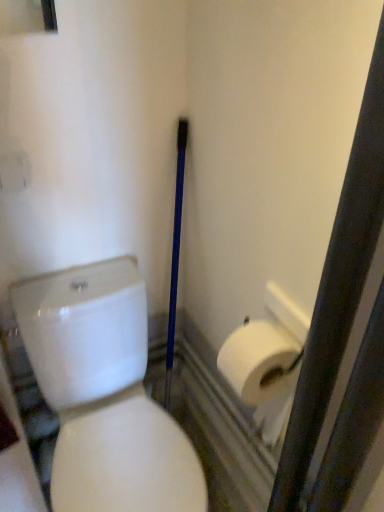
Question: Considering the relative sizes of white matte toilet paper at right and white glossy toilet at center in the image provided, is white matte toilet paper at right taller than white glossy toilet at center?

Choices:
 (A) yes
 (B) no

Answer: (B)

Question: Considering the relative sizes of white matte toilet paper at right and white glossy toilet at center in the image provided, is white matte toilet paper at right bigger than white glossy toilet at center?

Choices:
 (A) no
 (B) yes

Answer: (A)

Question: Is white matte toilet paper at right smaller than white glossy toilet at center?

Choices:
 (A) no
 (B) yes

Answer: (B)

Question: Does white matte toilet paper at right have a lesser height compared to white glossy toilet at center?

Choices:
 (A) yes
 (B) no

Answer: (A)

Question: Are white matte toilet paper at right and white glossy toilet at center making contact?

Choices:
 (A) no
 (B) yes

Answer: (A)

Question: Could you tell me if white matte toilet paper at right is turned towards white glossy toilet at center?

Choices:
 (A) no
 (B) yes

Answer: (B)

Question: From a real-world perspective, is white glossy toilet at center under white matte toilet paper at right?

Choices:
 (A) yes
 (B) no

Answer: (A)

Question: Considering the relative positions of white glossy toilet at center and white matte toilet paper at right in the image provided, is white glossy toilet at center to the right of white matte toilet paper at right from the viewer's perspective?

Choices:
 (A) yes
 (B) no

Answer: (B)

Question: Does white glossy toilet at center have a smaller size compared to white matte toilet paper at right?

Choices:
 (A) yes
 (B) no

Answer: (B)

Question: Does white glossy toilet at center have a greater width compared to white matte toilet paper at right?

Choices:
 (A) yes
 (B) no

Answer: (A)

Question: Does white glossy toilet at center have a lesser width compared to white matte toilet paper at right?

Choices:
 (A) yes
 (B) no

Answer: (B)

Question: Are white glossy toilet at center and white matte toilet paper at right far apart?

Choices:
 (A) no
 (B) yes

Answer: (A)

Question: Considering the positions of point (297, 352) and point (104, 370), is point (297, 352) closer or farther from the camera than point (104, 370)?

Choices:
 (A) closer
 (B) farther

Answer: (A)